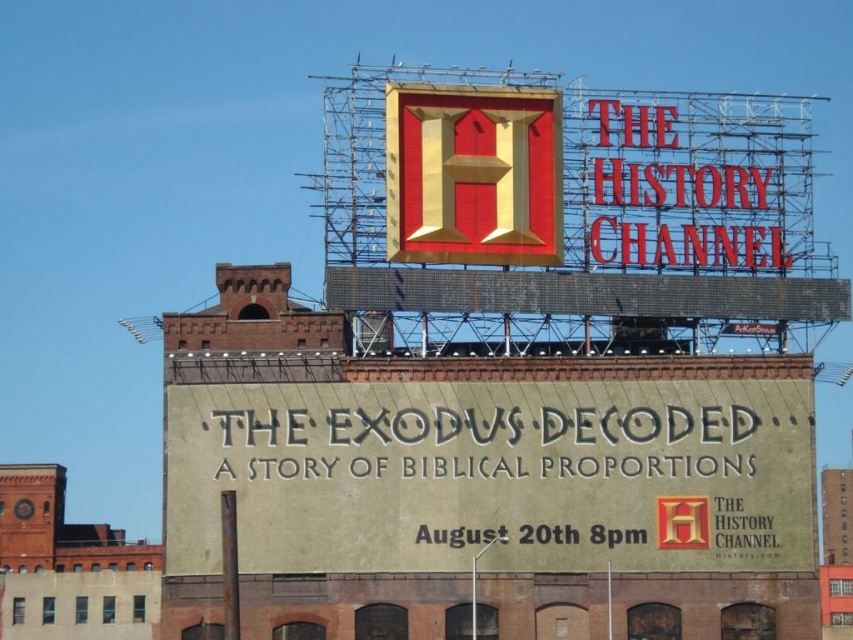
Looking at this image, which is more to the right, beige textured billboard at center or gold/red textured sign at center?

beige textured billboard at center

Is beige textured billboard at center to the left of gold/red textured sign at center from the viewer's perspective?

Incorrect, beige textured billboard at center is not on the left side of gold/red textured sign at center.

Which is in front, point (792, 499) or point (546, 129)?

Positioned in front is point (792, 499).

Where is `beige textured billboard at center`? Image resolution: width=853 pixels, height=640 pixels. beige textured billboard at center is located at coordinates (492, 476).